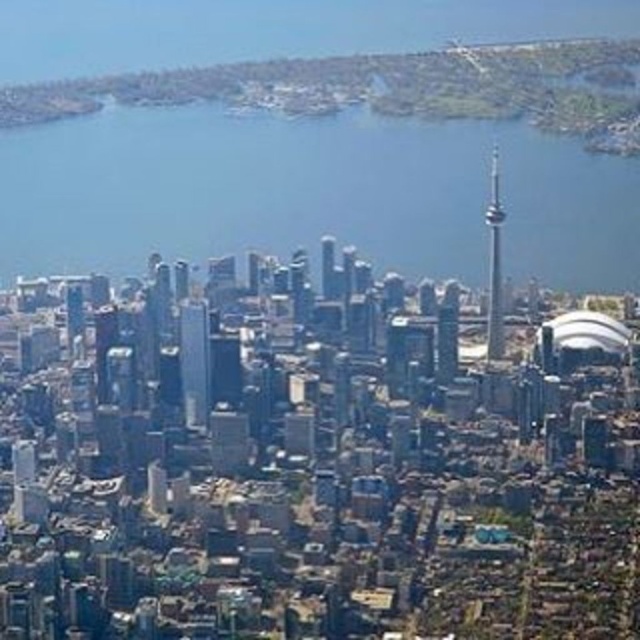
From the picture: Which is below, smooth glass tower at center or glassy reflective skyscraper at center?

glassy reflective skyscraper at center is below.

Can you confirm if smooth glass tower at center is smaller than glassy reflective skyscraper at center?

Actually, smooth glass tower at center might be larger than glassy reflective skyscraper at center.

Which is in front, point (497, 188) or point (324, 269)?

Point (324, 269) is in front.

Find the location of a particular element. smooth glass tower at center is located at coordinates pyautogui.click(x=493, y=264).

Which is above, blue water at center or smooth glass tower at center?

blue water at center is above.

Between blue water at center and smooth glass tower at center, which one appears on the left side from the viewer's perspective?

From the viewer's perspective, blue water at center appears more on the left side.

Is point (164, 163) behind point (490, 326)?

Yes, it is.

Where is `blue water at center`? The image size is (640, 640). blue water at center is located at coordinates (312, 193).

In the scene shown: Does metallic glass skyscraper at center have a smaller size compared to glassy reflective skyscraper at center?

No.

Is the position of metallic glass skyscraper at center less distant than that of glassy reflective skyscraper at center?

No, it is behind glassy reflective skyscraper at center.

This screenshot has height=640, width=640. Identify the location of metallic glass skyscraper at center. (195, 362).

The height and width of the screenshot is (640, 640). In order to click on metallic glass skyscraper at center in this screenshot , I will do `click(195, 362)`.